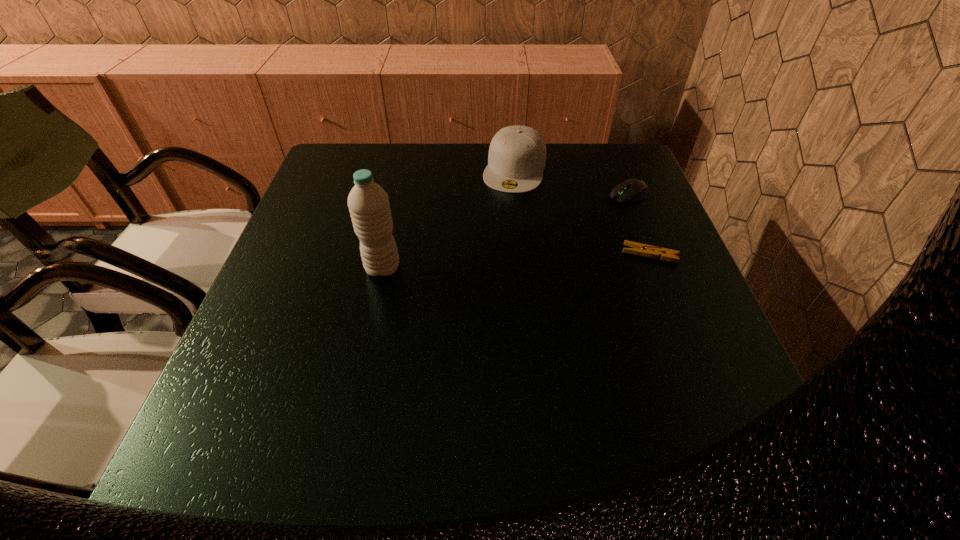
Image resolution: width=960 pixels, height=540 pixels. I want to click on free spot at the near edge of the desktop, so click(x=645, y=390).

This screenshot has height=540, width=960. Find the location of `blank area at the left edge`. blank area at the left edge is located at coordinates (307, 220).

At what (x,y) coordinates should I click in order to perform the action: click on free spot at the right edge of the desktop. Please return your answer as a coordinate pair (x, y). The width and height of the screenshot is (960, 540). Looking at the image, I should click on (686, 307).

The image size is (960, 540). I want to click on vacant region at the far right corner of the desktop, so click(x=598, y=152).

The image size is (960, 540). I want to click on vacant space at the near right corner, so click(x=684, y=394).

This screenshot has height=540, width=960. I want to click on vacant space that is in between the leftmost object and the second shortest object, so click(x=506, y=231).

Find the location of a particular element. The height and width of the screenshot is (540, 960). free point between the computer mouse and the clothespin is located at coordinates (639, 225).

At what (x,y) coordinates should I click in order to perform the action: click on free spot between the third shortest object and the computer mouse. Please return your answer as a coordinate pair (x, y). The image size is (960, 540). Looking at the image, I should click on (572, 181).

Find the location of a particular element. The image size is (960, 540). vacant space that's between the clothespin and the second shortest object is located at coordinates (639, 225).

The width and height of the screenshot is (960, 540). What are the coordinates of `vacant area that lies between the shortest object and the third object from right to left` in the screenshot? It's located at (582, 212).